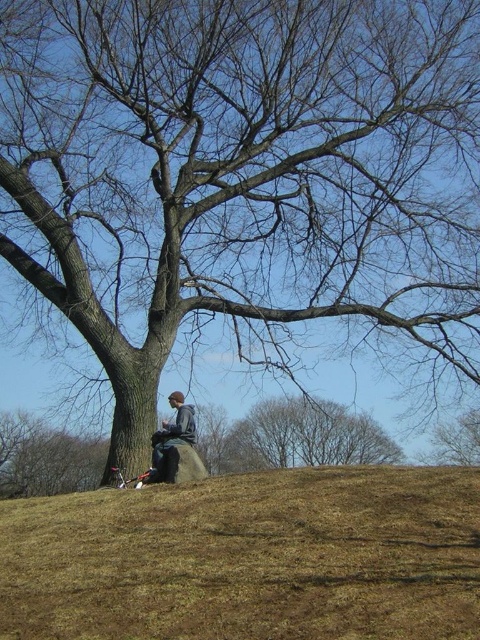
Question: Does brown dry grass at lower center appear on the right side of brown leafless tree at upper center?

Choices:
 (A) no
 (B) yes

Answer: (A)

Question: Is brown dry grass at lower center behind brown rough tree at center?

Choices:
 (A) yes
 (B) no

Answer: (B)

Question: Considering the real-world distances, which object is closest to the brown rough tree at center?

Choices:
 (A) gray fleece jacket at center
 (B) brown dry grass at lower center
 (C) brown leafless tree at upper center

Answer: (C)

Question: Among these objects, which one is nearest to the camera?

Choices:
 (A) brown leafless tree at upper center
 (B) gray fleece jacket at center
 (C) brown dry grass at lower center

Answer: (C)

Question: Can you confirm if brown rough tree at center is positioned to the right of brown leafless tree at upper center?

Choices:
 (A) yes
 (B) no

Answer: (B)

Question: Among these points, which one is nearest to the camera?

Choices:
 (A) (189, 440)
 (B) (385, 600)

Answer: (B)